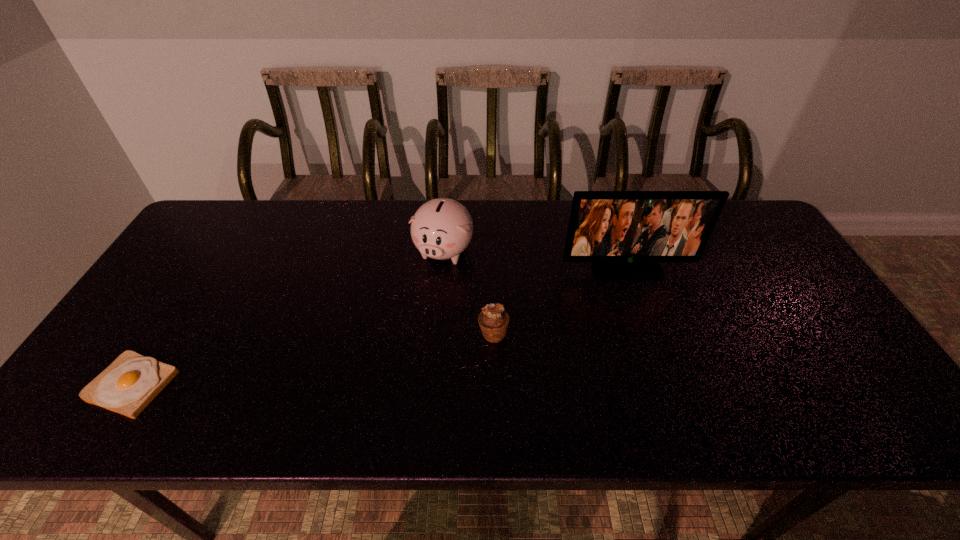
Find the location of a particular element. Image resolution: width=960 pixels, height=540 pixels. the tallest object is located at coordinates (624, 233).

At what (x,y) coordinates should I click in order to perform the action: click on the rightmost object. Please return your answer as a coordinate pair (x, y). This screenshot has width=960, height=540. Looking at the image, I should click on (624, 233).

At what (x,y) coordinates should I click in order to perform the action: click on piggy bank. Please return your answer as a coordinate pair (x, y). This screenshot has width=960, height=540. Looking at the image, I should click on (442, 228).

Locate an element on the screen. the second object from left to right is located at coordinates (442, 228).

Find the location of a particular element. the second nearest object is located at coordinates (493, 320).

Find the location of a particular element. muffin is located at coordinates (493, 320).

Identify the location of toast. (127, 386).

The height and width of the screenshot is (540, 960). Find the location of `the nearest object`. the nearest object is located at coordinates (127, 386).

Find the location of a particular element. Image resolution: width=960 pixels, height=540 pixels. free spot located on the front-facing side of the rightmost object is located at coordinates (669, 397).

This screenshot has height=540, width=960. I want to click on free space located on the left of the piggy bank, so click(361, 251).